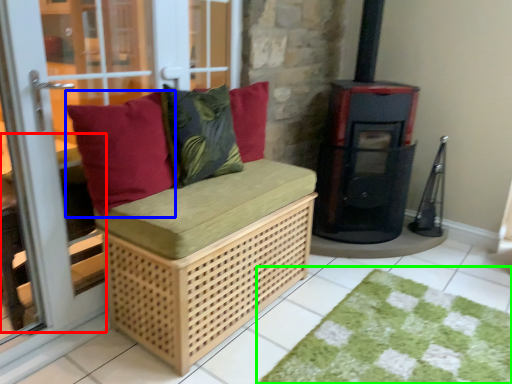
Question: Based on their relative distances, which object is farther from table (highlighted by a red box)? Choose from pillow (highlighted by a blue box) and doormat (highlighted by a green box).

Choices:
 (A) pillow
 (B) doormat

Answer: (B)